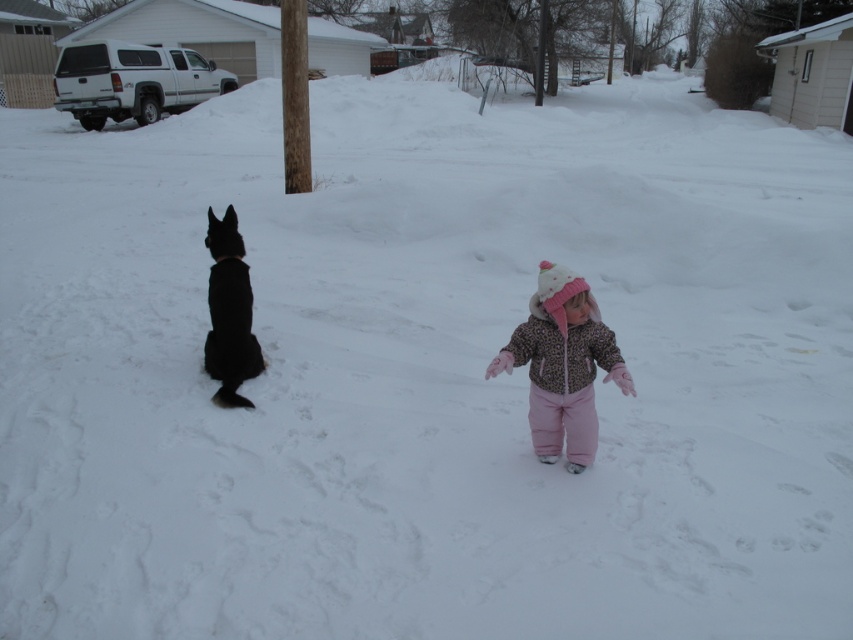
Consider the image. You are a photographer trying to capture a photo of the leopard print jacket at center and the black fur dog at left. If you want to ensure both subjects are fully visible in the frame, which subject should you adjust your camera focus on first?

The leopard print jacket at center is wider than the black fur dog at left, so you should adjust your camera focus on the leopard print jacket at center first to ensure it fits in the frame.